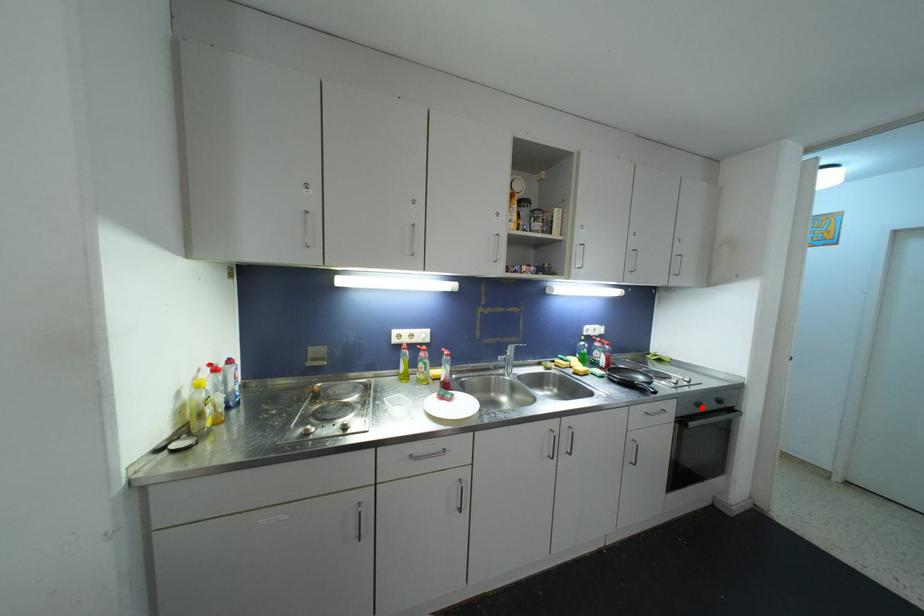
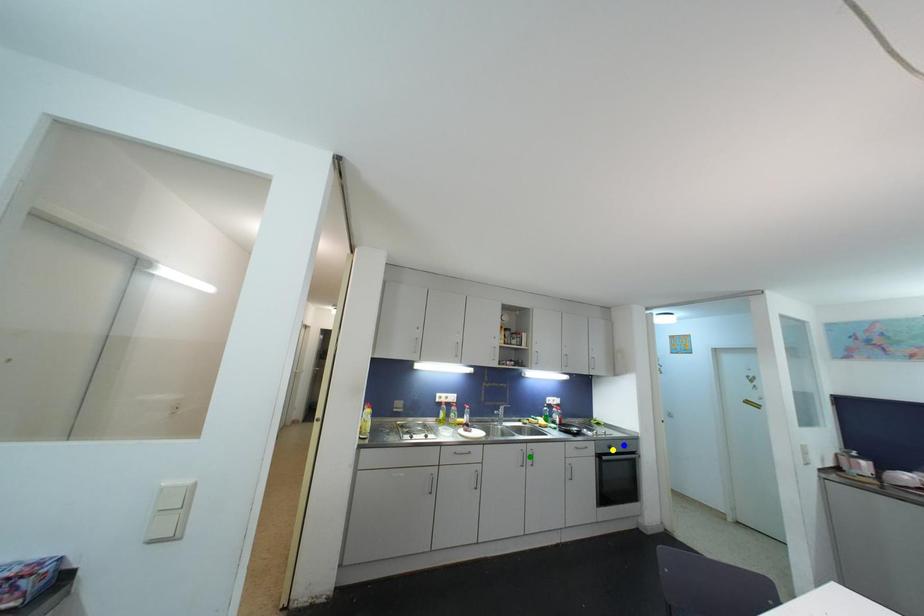
Question: I am providing you with two images of the same scene from different viewpoints. A red point is marked on the first image. You are given multiple points on the second image. Which point in image 2 represents the same 3d spot as the red point in image 1?

Choices:
 (A) blue point
 (B) green point
 (C) yellow point

Answer: (C)